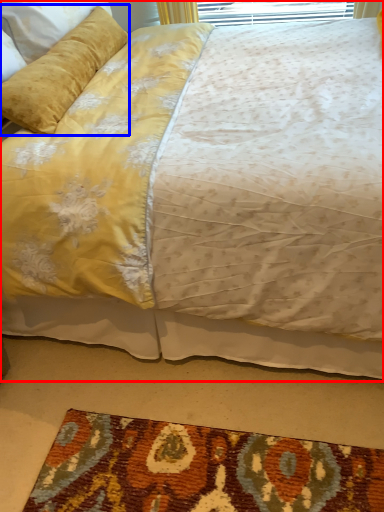
Question: Which object appears farthest to the camera in this image, bed (highlighted by a red box) or pillow (highlighted by a blue box)?

Choices:
 (A) bed
 (B) pillow

Answer: (B)